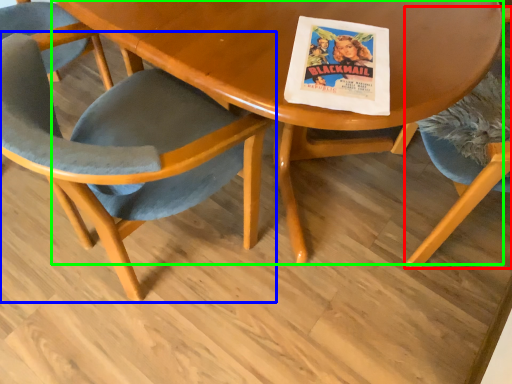
Question: Based on their relative distances, which object is nearer to chair (highlighted by a red box)? Choose from chair (highlighted by a blue box) and table (highlighted by a green box).

Choices:
 (A) chair
 (B) table

Answer: (B)